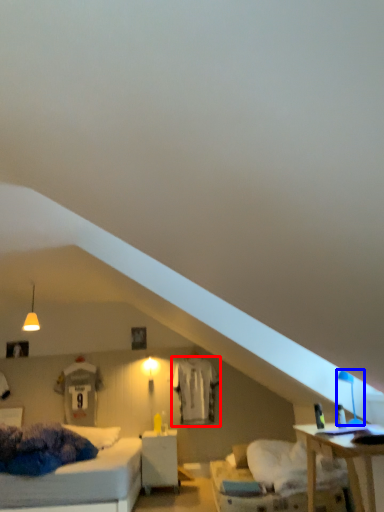
Question: Which of the following is the closest to the observer, sheet (highlighted by a red box) or table lamp (highlighted by a blue box)?

Choices:
 (A) sheet
 (B) table lamp

Answer: (B)